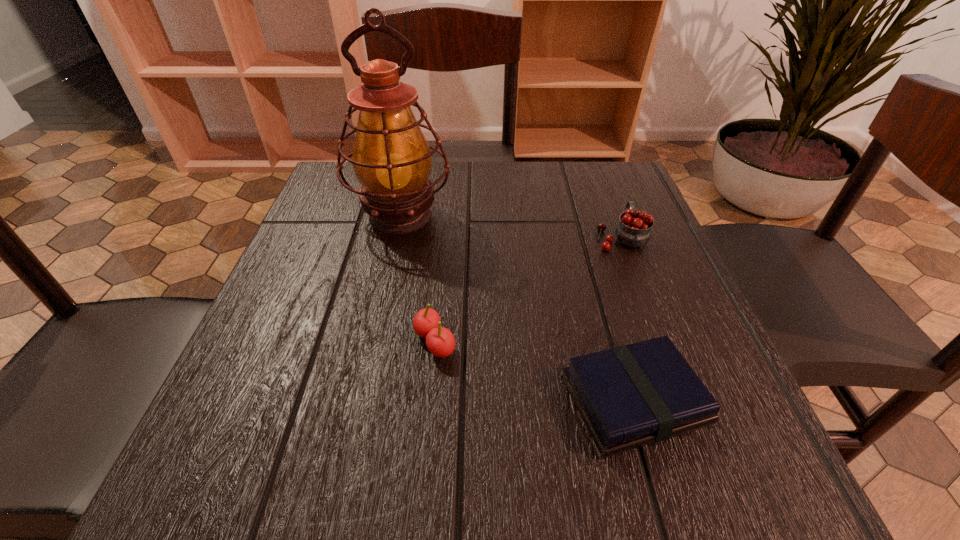
Locate an element on the screen. This screenshot has width=960, height=540. vacant space at the near edge of the desktop is located at coordinates (379, 482).

In the image, there is a desktop. Identify the location of free region at the left edge. The height and width of the screenshot is (540, 960). (343, 238).

In order to click on free location at the right edge of the desktop in this screenshot , I will do `click(684, 354)`.

I want to click on vacant area at the near left corner of the desktop, so click(x=297, y=455).

Where is `vacant space at the far right corner of the desktop`? vacant space at the far right corner of the desktop is located at coordinates (593, 198).

Locate an element on the screen. This screenshot has width=960, height=540. free space between the farther cherry and the shortest object is located at coordinates (628, 319).

I want to click on empty space between the second shortest object and the oil lamp, so click(x=418, y=279).

Image resolution: width=960 pixels, height=540 pixels. I want to click on blank region between the shortest object and the nearer cherry, so click(535, 371).

The height and width of the screenshot is (540, 960). Find the location of `vacant area between the book and the farther cherry`. vacant area between the book and the farther cherry is located at coordinates (628, 319).

The height and width of the screenshot is (540, 960). In order to click on vacant region between the oil lamp and the third tallest object in this screenshot , I will do `click(418, 279)`.